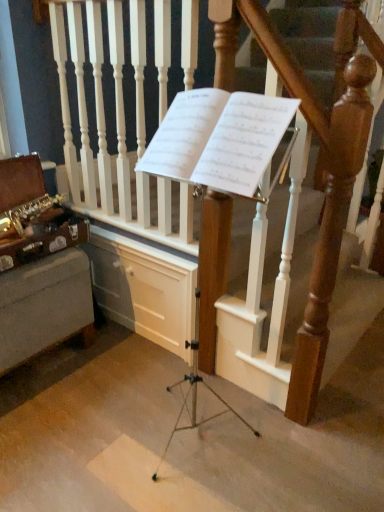
Question: Is wooden at center placed right next to gold brass saxophone at left?

Choices:
 (A) no
 (B) yes

Answer: (A)

Question: Is wooden at center completely or partially outside of gold brass saxophone at left?

Choices:
 (A) no
 (B) yes

Answer: (B)

Question: Is the position of wooden at center less distant than that of gold brass saxophone at left?

Choices:
 (A) yes
 (B) no

Answer: (A)

Question: Does wooden at center have a smaller size compared to gold brass saxophone at left?

Choices:
 (A) no
 (B) yes

Answer: (A)

Question: Considering the relative sizes of wooden at center and gold brass saxophone at left in the image provided, is wooden at center shorter than gold brass saxophone at left?

Choices:
 (A) yes
 (B) no

Answer: (B)

Question: Does wooden at center have a lesser width compared to gold brass saxophone at left?

Choices:
 (A) no
 (B) yes

Answer: (B)

Question: Is white paper at center wider than wooden at center?

Choices:
 (A) yes
 (B) no

Answer: (A)

Question: Would you say wooden at center is part of white paper at center's contents?

Choices:
 (A) no
 (B) yes

Answer: (A)

Question: Is white paper at center smaller than wooden at center?

Choices:
 (A) no
 (B) yes

Answer: (B)

Question: Considering the relative sizes of white paper at center and wooden at center in the image provided, is white paper at center taller than wooden at center?

Choices:
 (A) yes
 (B) no

Answer: (B)

Question: From the image's perspective, is white paper at center located above wooden at center?

Choices:
 (A) yes
 (B) no

Answer: (A)

Question: From a real-world perspective, is white paper at center under wooden at center?

Choices:
 (A) no
 (B) yes

Answer: (A)

Question: Is white paper at center in contact with gold brass saxophone at left?

Choices:
 (A) yes
 (B) no

Answer: (B)